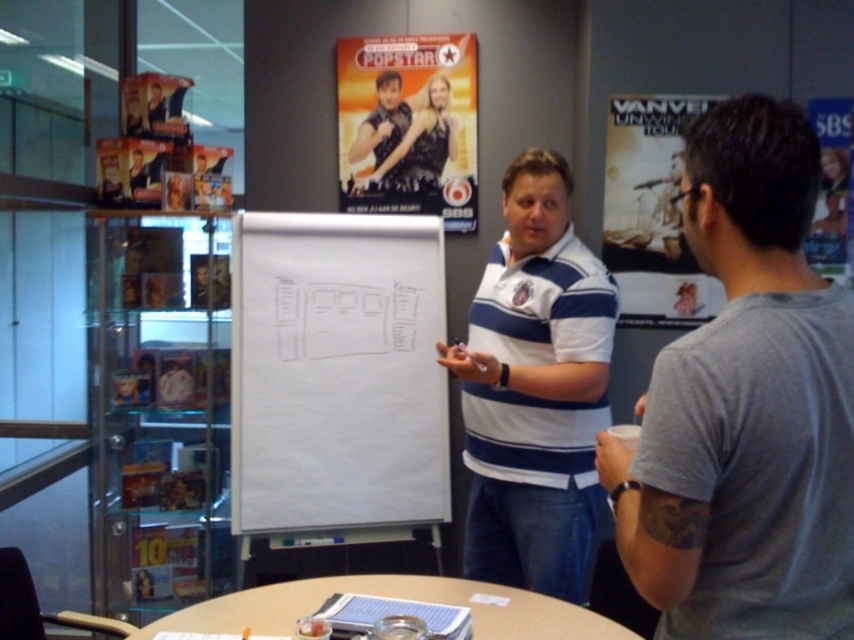
Is metallic glossy poster at upper center smaller than shiny black dress at center?

No.

Who is more forward, (379, 38) or (422, 188)?

Point (379, 38) is in front.

Between point (455, 204) and point (402, 124), which one is positioned behind?

The point (455, 204) is more distant.

This screenshot has height=640, width=854. Find the location of `metallic glossy poster at upper center`. metallic glossy poster at upper center is located at coordinates (408, 125).

Can you confirm if metallic glossy poster at upper center is taller than wooden round table at center?

Yes.

Does point (346, 141) come behind point (226, 616)?

Yes, point (346, 141) is farther from viewer.

Where is `metallic glossy poster at upper center`? metallic glossy poster at upper center is located at coordinates (408, 125).

From the picture: Who is taller, white striped polo shirt at center or white paper poster at upper right?

white striped polo shirt at center is taller.

Who is more distant from viewer, [521,336] or [616,220]?

The point [616,220] is more distant.

Which is behind, point (506, 380) or point (671, 115)?

The point (671, 115) is behind.

This screenshot has height=640, width=854. Find the location of `white striped polo shirt at center`. white striped polo shirt at center is located at coordinates (534, 388).